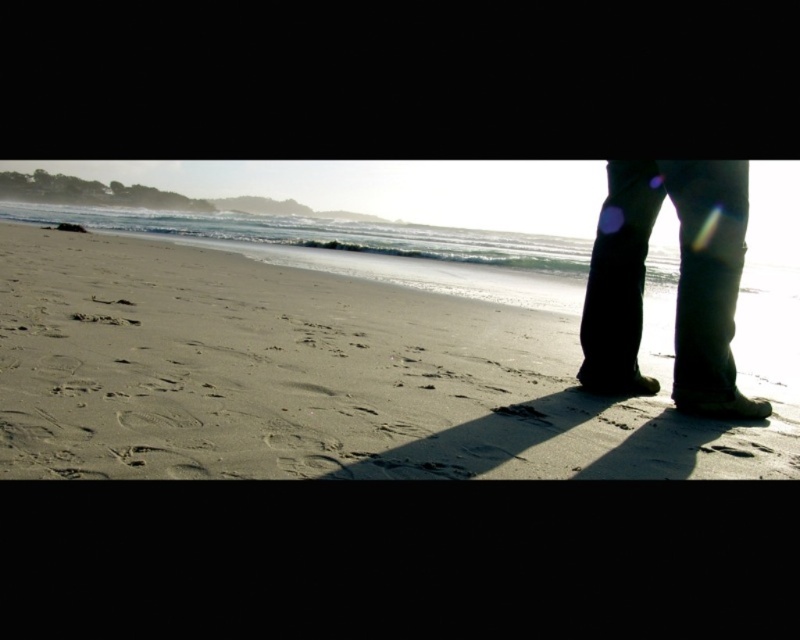
Based on the photo, you are standing on the sandy beach at lower center and looking towards the dark denim pants at lower right. Which object is closer to the water?

The sandy beach at lower center is positioned under the dark denim pants at lower right, meaning the sandy beach at lower center is closer to the water than the dark denim pants at lower right.

You are standing on the sandy beach at lower center and want to see the dark denim pants at lower right. Which object is taller?

The dark denim pants at lower right are taller than the sandy beach at lower center.